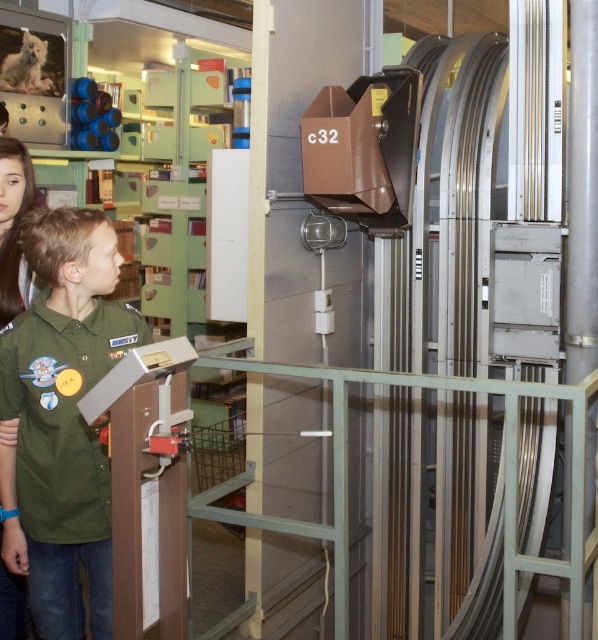
Who is more distant from viewer, (78, 435) or (1, 216)?

Positioned behind is point (1, 216).

Is green matte shirt at left below matte green shirt at left?

Yes.

I want to click on green matte shirt at left, so click(62, 420).